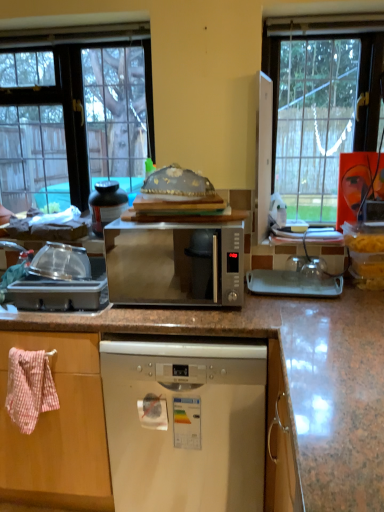
Question: From the image's perspective, relative to clear glass window at upper left, is pink woven towel at left above or below?

Choices:
 (A) above
 (B) below

Answer: (B)

Question: Is pink woven towel at left bigger or smaller than clear glass window at upper left?

Choices:
 (A) small
 (B) big

Answer: (A)

Question: Which of these objects is positioned farthest from the satin silver microwave at center, placed as the 2th appliance when sorted from bottom to top?

Choices:
 (A) clear plastic container at left, the first appliance viewed from the front
 (B) satin silver dishwasher at center
 (C) pink woven towel at left
 (D) clear glass window at upper left
 (E) satin silver microwave at center

Answer: (B)

Question: Estimate the real-world distances between objects in this image. Which object is closer to the pink woven towel at left?

Choices:
 (A) satin silver microwave at center, positioned as the first appliance in top-to-bottom order
 (B) satin silver dishwasher at center
 (C) clear plastic container at left, the 2th appliance from the top
 (D) clear glass window at upper left
 (E) satin silver microwave at center

Answer: (C)